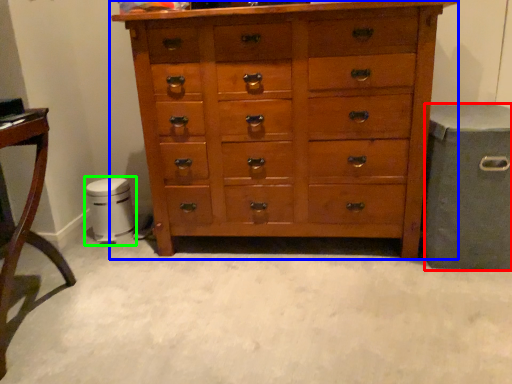
Question: Considering the real-world distances, which object is closest to gray (highlighted by a red box)? chest of drawers (highlighted by a blue box) or music stool (highlighted by a green box).

Choices:
 (A) chest of drawers
 (B) music stool

Answer: (A)